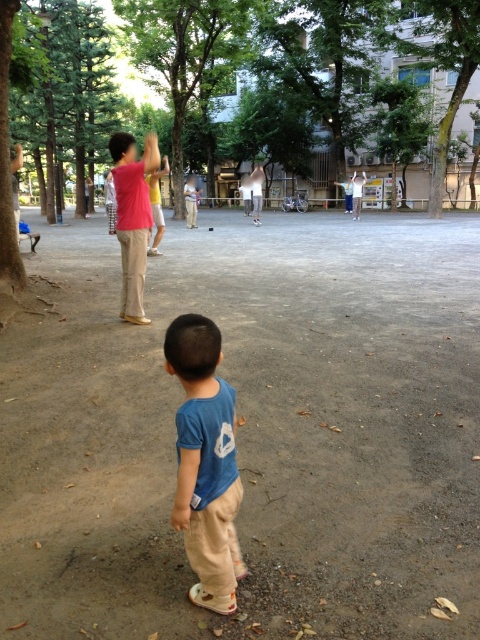
You are a photographer trying to capture a photo of the light brown wood bench at center without the green leafy tree at upper center blocking it. Based on their positions, can you position yourself in a way to exclude the tree from the frame?

The green leafy tree at upper center is closer to the viewer than the light brown wood bench at center. To exclude the tree from the frame, you would need to move your position so that the tree is no longer between you and the bench. Since the tree is closer, adjusting your angle or moving sideways might allow you to frame the bench without the tree obstructing it.